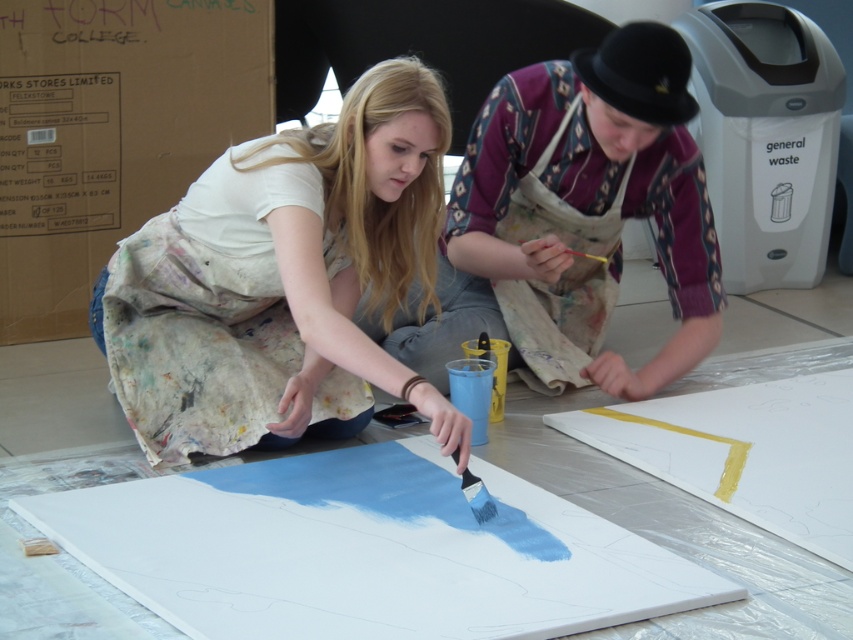
You are an art instructor trying to distribute a red wooden paint brush at center to a student wearing a matte white shirt at center. Since both are in the center, can you easily hand the brush to the student without moving either?

The matte white shirt at center is wider than the red wooden paint brush at center, so it might be challenging to hand the brush directly due to the shirt taking up more space in the center area.

You are an art instructor standing in the studio and need to retrieve the red wooden paint brush at center. You are currently holding the matte white shirt at center. Can you reach the brush without letting go of the shirt?

The matte white shirt at center is 1.04 meters away from the red wooden paint brush at center. Since the distance is greater than an average person can reach while holding an object, you would need to let go of the shirt to reach the brush.